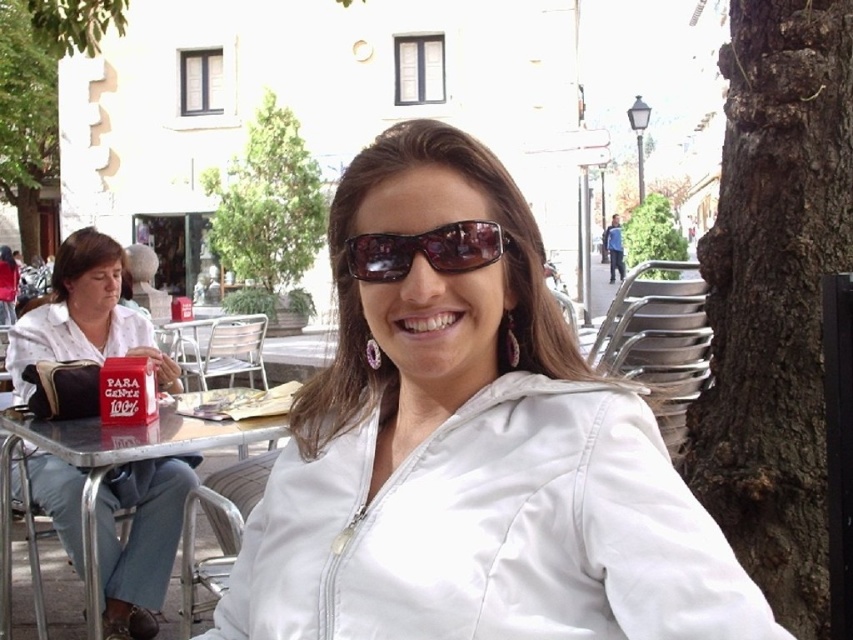
You are standing in the outdoor cafe scene and want to take a photo of both the point at coordinates point (x=30, y=150) and point (x=392, y=248). Since you want both points to be in focus, which point should you focus on first to ensure both are clear?

You should focus on the point at coordinates point (x=30, y=150) first because it is closer to the camera than point (x=392, y=248). This way, the depth of field will cover both points.

You are a photographer trying to capture a clear shot of the sunglasses at center without the green leafy tree at left blocking the view. Based on their positions, can you position yourself in a way to avoid the tree?

The green leafy tree at left is further to the viewer than sunglasses at center, so you can move your position to the right side of the frame to avoid the tree blocking the view of the sunglasses at center.